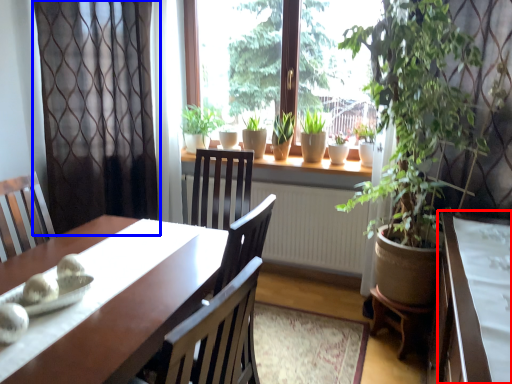
Question: Which object is closer to the camera taking this photo, table (highlighted by a red box) or curtain (highlighted by a blue box)?

Choices:
 (A) table
 (B) curtain

Answer: (A)